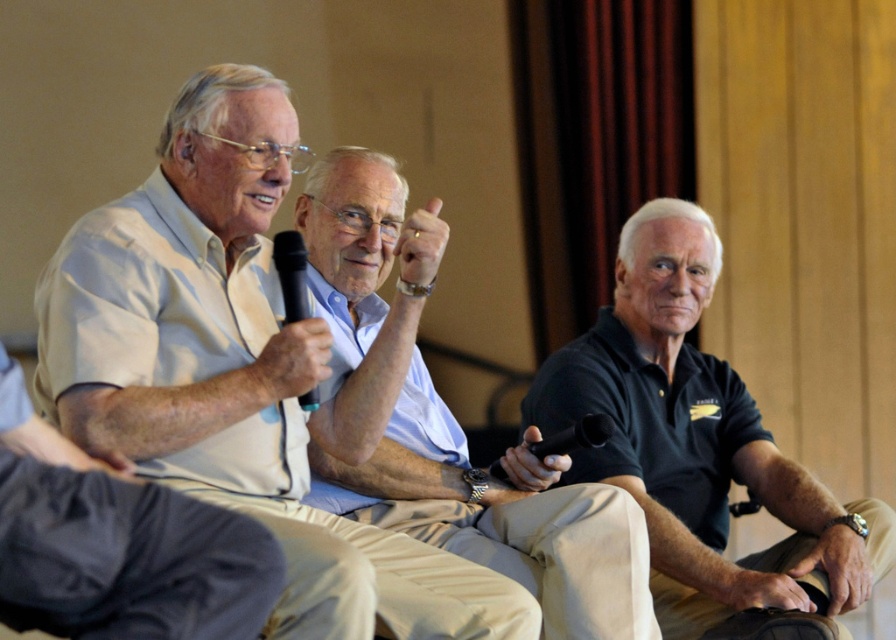
You are a photographer setting up for a group photo. You need to ensure all subjects are visible in the frame. Given the light beige shirt at left and the matte gold ring at upper center, which subject should be positioned closer to the center to avoid being cropped out?

The matte gold ring at upper center should be positioned closer to the center to avoid being cropped out since it is smaller than the light beige shirt at left.

In the scene shown: You are an interior designer who needs to place a new decorative item exactly where the matte gold ring at upper center is located. According to the coordinates provided, what are the coordinates where you should place the new item?

The coordinates for the matte gold ring at upper center are at point [421,244], so you should place the new item at those coordinates.